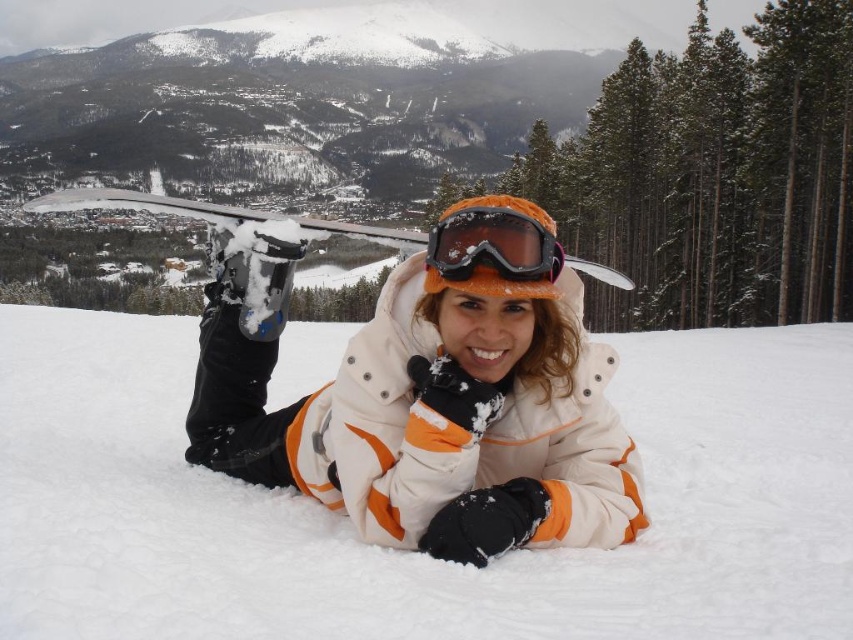
Is point (792, 369) more distant than point (549, 268)?

Yes, point (792, 369) is behind point (549, 268).

Measure the distance between white snow at center and orange matte/glossy goggles at center.

They are 94.09 feet apart.

What do you see at coordinates (416, 554) in the screenshot? The image size is (853, 640). I see `white snow at center` at bounding box center [416, 554].

At what (x,y) coordinates should I click in order to perform the action: click on white snow at center. Please return your answer as a coordinate pair (x, y). Looking at the image, I should click on (416, 554).